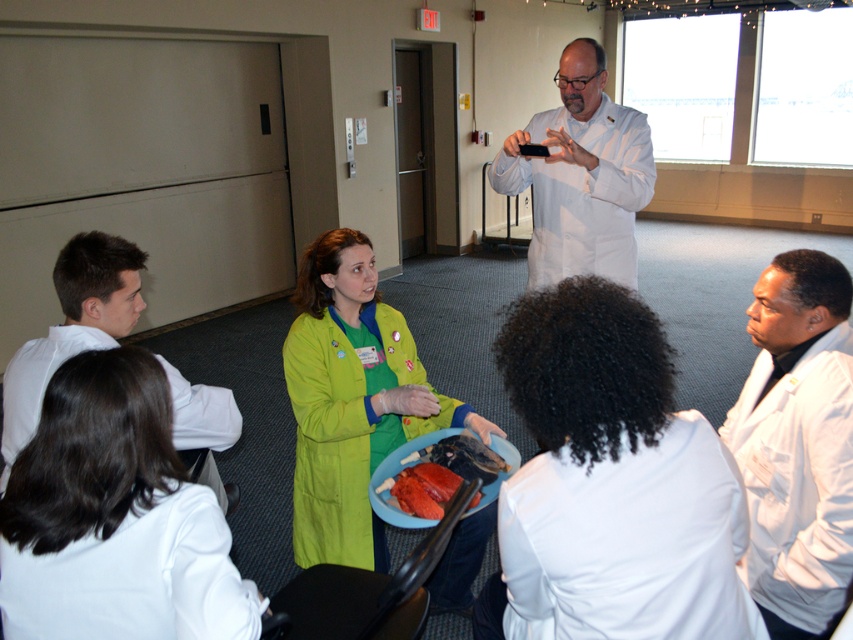
Question: Does white matte lab coat at upper center appear over white matte lab coat at left?

Choices:
 (A) no
 (B) yes

Answer: (B)

Question: Is matte green lab coat at lower left smaller than white matte lab coat at upper center?

Choices:
 (A) yes
 (B) no

Answer: (A)

Question: Is green matte coat at center below shiny red meat at center?

Choices:
 (A) yes
 (B) no

Answer: (B)

Question: Which point appears farthest from the camera in this image?

Choices:
 (A) (813, 596)
 (B) (113, 252)
 (C) (651, 468)

Answer: (B)

Question: Among these objects, which one is farthest from the camera?

Choices:
 (A) white matte lab coat at left
 (B) shiny red meat at center

Answer: (B)

Question: Which point appears closest to the camera in this image?

Choices:
 (A) (364, 525)
 (B) (537, 403)
 (C) (206, 456)
 (D) (776, 346)

Answer: (B)